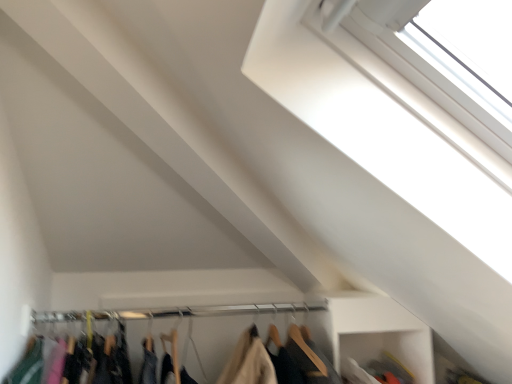
You are a GUI agent. You are given a task and a screenshot of the screen. Output one action in this format:
    pyautogui.click(x=<x>, y=<y>)
    Task: Click on the metallic silver clothesline at center
    The height and width of the screenshot is (384, 512).
    Given the screenshot: What is the action you would take?
    pyautogui.click(x=173, y=312)

What is the approximate width of metallic silver clothesline at center?

metallic silver clothesline at center is 1.65 inches in width.

What do you see at coordinates (385, 128) in the screenshot? I see `white plastic window at upper right` at bounding box center [385, 128].

This screenshot has height=384, width=512. Find the location of `wooden hangers at lower center`. wooden hangers at lower center is located at coordinates (168, 313).

Looking at this image, from a real-world perspective, is white plastic window at upper right located beneath metallic silver clothesline at center?

Incorrect, from a real-world perspective, white plastic window at upper right is higher than metallic silver clothesline at center.

Is there a large distance between white plastic window at upper right and metallic silver clothesline at center?

white plastic window at upper right is near metallic silver clothesline at center, not far away.

Who is taller, white plastic window at upper right or metallic silver clothesline at center?

white plastic window at upper right.

In terms of width, does white plastic window at upper right look wider or thinner when compared to metallic silver clothesline at center?

white plastic window at upper right is wider than metallic silver clothesline at center.

There is a wooden hangers at lower center. Where is `window above it (from a real-world perspective)`? The image size is (512, 384). window above it (from a real-world perspective) is located at coordinates (385, 128).

From the picture: From a real-world perspective, is white plastic window at upper right on top of wooden hangers at lower center?

Correct, in the physical world, white plastic window at upper right is higher than wooden hangers at lower center.

Is point (289, 95) positioned in front of point (37, 367)?

That is True.

Is white plastic window at upper right oriented towards wooden hangers at lower center?

No, white plastic window at upper right is not aimed at wooden hangers at lower center.

From a real-world perspective, which object rests below the other?

From a 3D spatial view, wooden hangers at lower center is below.

Can you confirm if wooden hangers at lower center is smaller than white plastic window at upper right?

Correct, wooden hangers at lower center occupies less space than white plastic window at upper right.

Considering the relative sizes of wooden hangers at lower center and white plastic window at upper right in the image provided, is wooden hangers at lower center shorter than white plastic window at upper right?

Correct, wooden hangers at lower center is not as tall as white plastic window at upper right.

Is wooden hangers at lower center turned away from white plastic window at upper right?

No, white plastic window at upper right is not at the back of wooden hangers at lower center.

Is metallic silver clothesline at center inside the boundaries of white plastic window at upper right, or outside?

metallic silver clothesline at center is outside white plastic window at upper right.

How much distance is there between metallic silver clothesline at center and white plastic window at upper right?

The distance of metallic silver clothesline at center from white plastic window at upper right is 95.20 centimeters.

From a real-world perspective, relative to white plastic window at upper right, is metallic silver clothesline at center vertically above or below?

metallic silver clothesline at center is situated lower than white plastic window at upper right in the real world.

Between metallic silver clothesline at center and white plastic window at upper right, which one has smaller width?

metallic silver clothesline at center.

Is metallic silver clothesline at center shorter than wooden hangers at lower center?

Indeed, metallic silver clothesline at center has a lesser height compared to wooden hangers at lower center.

Is metallic silver clothesline at center at the right side of wooden hangers at lower center?

No.

Relative to wooden hangers at lower center, is metallic silver clothesline at center in front or behind?

metallic silver clothesline at center is behind wooden hangers at lower center.

Is wooden hangers at lower center with metallic silver clothesline at center?

Yes, the surface of wooden hangers at lower center is in contact with metallic silver clothesline at center.

Is wooden hangers at lower center to the right of metallic silver clothesline at center from the viewer's perspective?

Correct, you'll find wooden hangers at lower center to the right of metallic silver clothesline at center.

Can you tell me how much wooden hangers at lower center and metallic silver clothesline at center differ in facing direction?

They differ by 0.628 degrees in their facing directions.

From a real-world perspective, who is located lower, wooden hangers at lower center or metallic silver clothesline at center?

wooden hangers at lower center, from a real-world perspective.

The width and height of the screenshot is (512, 384). I want to click on clothesline on the left of white plastic window at upper right, so click(x=173, y=312).

Find the location of `closet below the white plastic window at upper right (from a real-world perspective)`. closet below the white plastic window at upper right (from a real-world perspective) is located at coordinates (168, 313).

Considering their positions, is wooden hangers at lower center positioned further to metallic silver clothesline at center than white plastic window at upper right?

The object further to metallic silver clothesline at center is white plastic window at upper right.

When comparing their distances from metallic silver clothesline at center, does white plastic window at upper right or wooden hangers at lower center seem further?

white plastic window at upper right.

Consider the image. Considering their positions, is metallic silver clothesline at center positioned closer to white plastic window at upper right than wooden hangers at lower center?

metallic silver clothesline at center lies closer to white plastic window at upper right than the other object.

Consider the image. From the image, which object appears to be farther from wooden hangers at lower center, metallic silver clothesline at center or white plastic window at upper right?

white plastic window at upper right is further to wooden hangers at lower center.

Which object lies further to the anchor point wooden hangers at lower center, white plastic window at upper right or metallic silver clothesline at center?

Among the two, white plastic window at upper right is located further to wooden hangers at lower center.

When comparing their distances from white plastic window at upper right, does wooden hangers at lower center or metallic silver clothesline at center seem closer?

metallic silver clothesline at center is closer to white plastic window at upper right.

Image resolution: width=512 pixels, height=384 pixels. What are the coordinates of `closet between white plastic window at upper right and metallic silver clothesline at center in the front-back direction` in the screenshot? It's located at (168, 313).